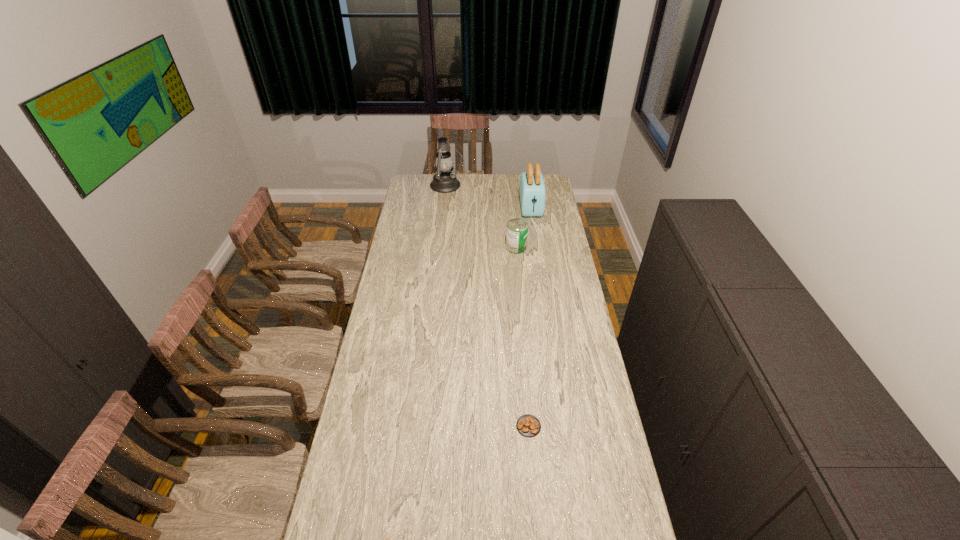
Where is `free space between the third farthest object and the tallest object`? This screenshot has width=960, height=540. free space between the third farthest object and the tallest object is located at coordinates pyautogui.click(x=482, y=217).

Locate an element on the screen. The image size is (960, 540). vacant area that lies between the farthest object and the right pastry is located at coordinates pyautogui.click(x=488, y=306).

At what (x,y) coordinates should I click in order to perform the action: click on free spot between the toaster and the tallest object. Please return your answer as a coordinate pair (x, y). This screenshot has width=960, height=540. Looking at the image, I should click on (490, 197).

Locate an element on the screen. free point between the shorter pastry and the second farthest object is located at coordinates (530, 317).

This screenshot has height=540, width=960. I want to click on empty space between the tallest object and the toaster, so click(x=490, y=197).

You are a GUI agent. You are given a task and a screenshot of the screen. Output one action in this format:
    pyautogui.click(x=<x>, y=<y>)
    Task: Click on the fourth closest object to the third tallest object
    The width and height of the screenshot is (960, 540).
    Given the screenshot: What is the action you would take?
    pyautogui.click(x=383, y=539)

Identify the location of object that is the second closest to the nearer pastry. (517, 229).